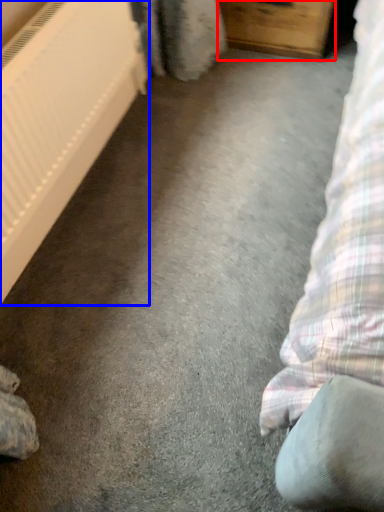
Question: Which object is closer to the camera taking this photo, furniture (highlighted by a red box) or radiator (highlighted by a blue box)?

Choices:
 (A) furniture
 (B) radiator

Answer: (B)